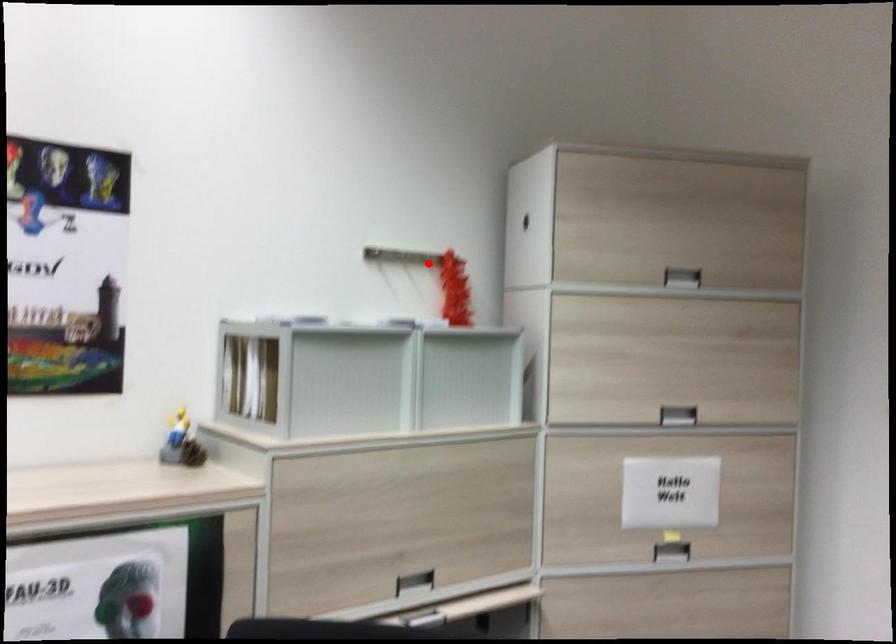
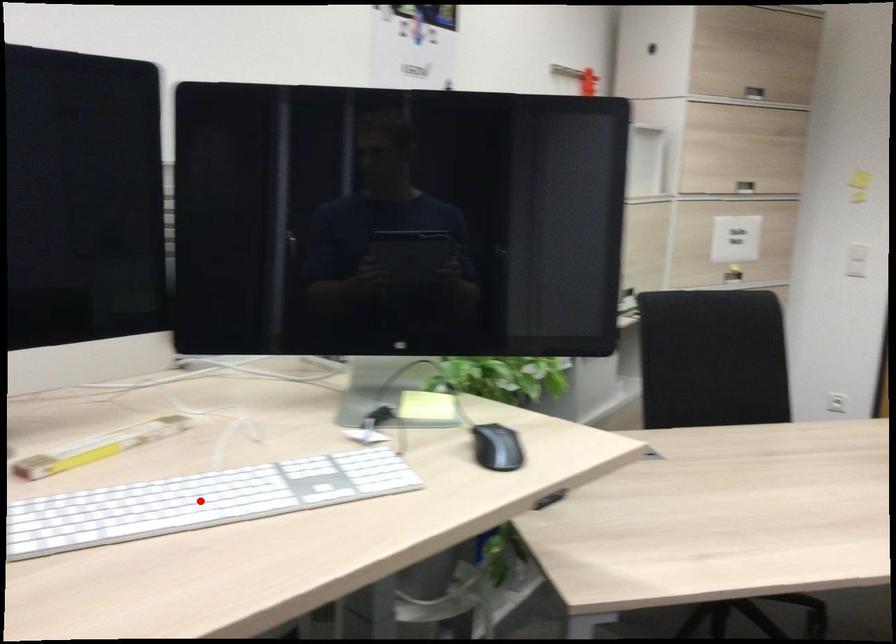
I am providing you with two images of the same scene from different viewpoints. A red point is marked on the first image and another point is marked on the second image. Does the point marked in image1 correspond to the same location as the one in image2?

No